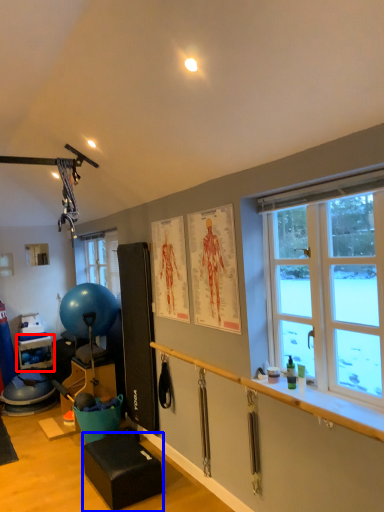
Question: Among these objects, which one is nearest to the camera, shelf (highlighted by a red box) or furniture (highlighted by a blue box)?

Choices:
 (A) shelf
 (B) furniture

Answer: (B)